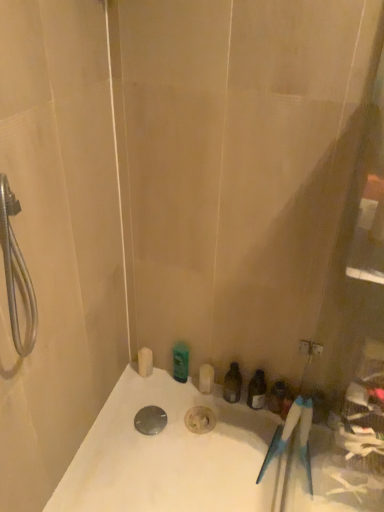
Where is `vacant area that is situated to the right of polished metallic drain at center`? The height and width of the screenshot is (512, 384). vacant area that is situated to the right of polished metallic drain at center is located at coordinates (193, 428).